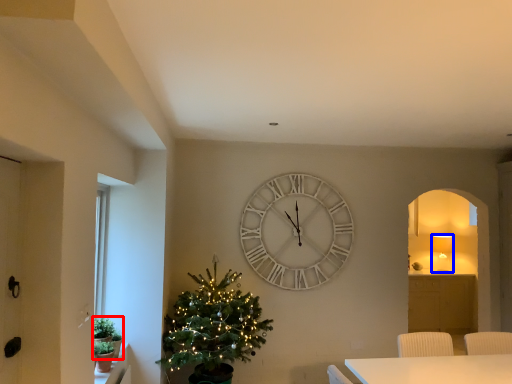
Question: Which object is further to the camera taking this photo, plant (highlighted by a red box) or lamp (highlighted by a blue box)?

Choices:
 (A) plant
 (B) lamp

Answer: (B)